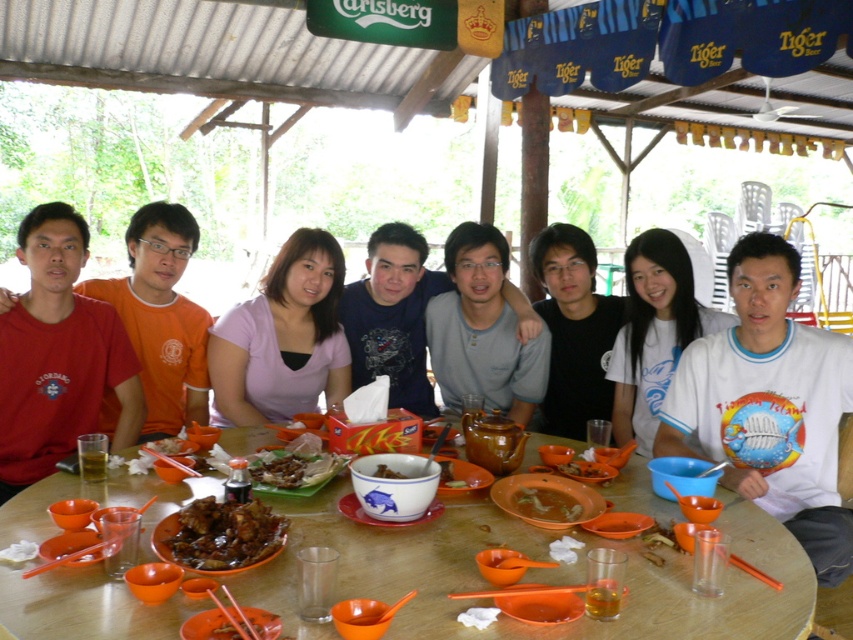
The width and height of the screenshot is (853, 640). Find the location of `black matte shirt at center`. black matte shirt at center is located at coordinates (573, 330).

Can you confirm if black matte shirt at center is positioned to the left of brown matte soup bowl at center?

Incorrect, black matte shirt at center is not on the left side of brown matte soup bowl at center.

Locate an element on the screen. black matte shirt at center is located at coordinates (573, 330).

Does matte purple shirt at center appear over brown matte fried chicken at center?

Yes.

Which is behind, point (335, 396) or point (297, 460)?

The point (335, 396) is more distant.

This screenshot has height=640, width=853. In order to click on matte purple shirt at center in this screenshot , I will do `click(283, 339)`.

Looking at this image, can you confirm if matte red shirt at left is wider than brown matte chicken at center?

Yes, matte red shirt at left is wider than brown matte chicken at center.

The image size is (853, 640). Describe the element at coordinates (57, 355) in the screenshot. I see `matte red shirt at left` at that location.

What are the coordinates of `matte red shirt at left` in the screenshot? It's located at (57, 355).